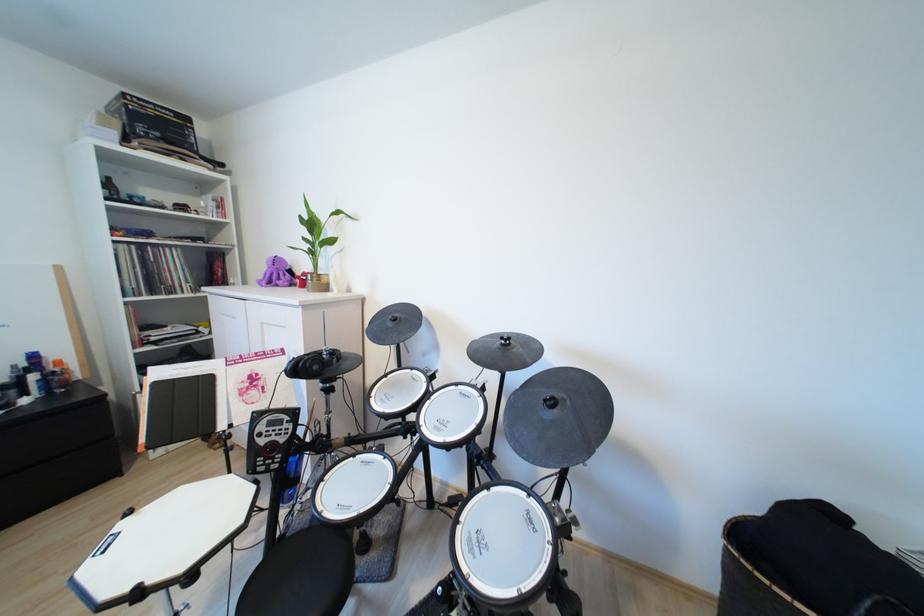
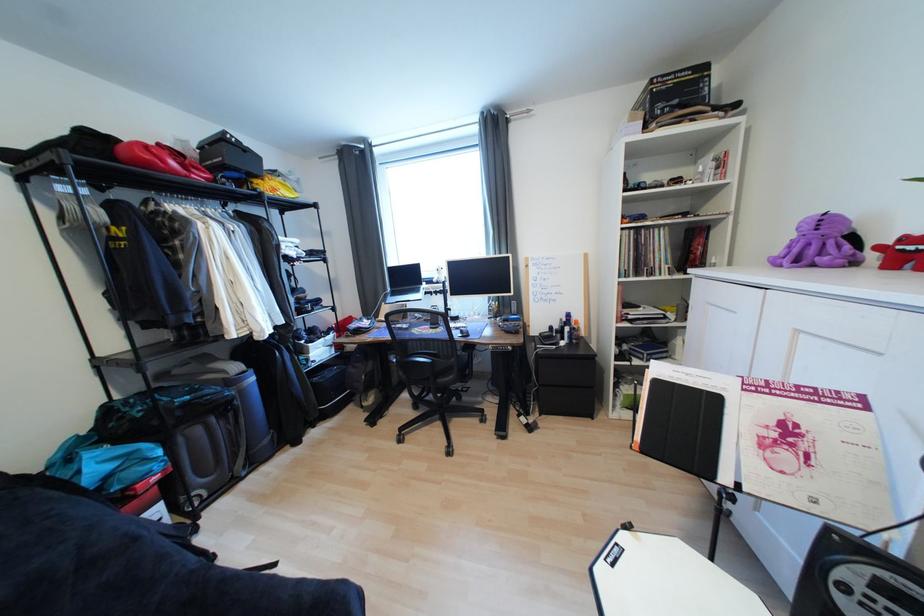
Question: The first image is from the beginning of the video and the second image is from the end. How did the camera likely rotate when shooting the video?

Choices:
 (A) Left
 (B) Right
 (C) Up
 (D) Down

Answer: (A)